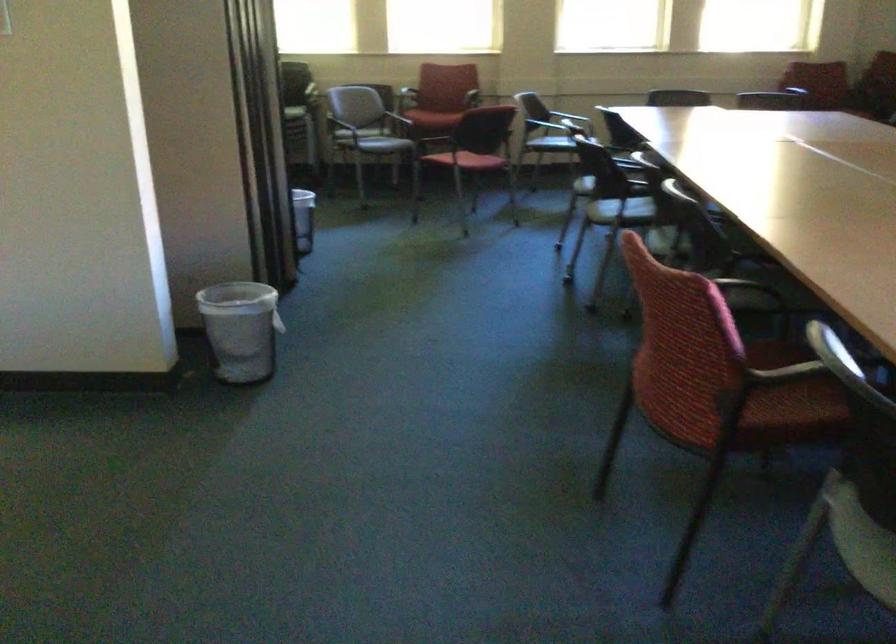
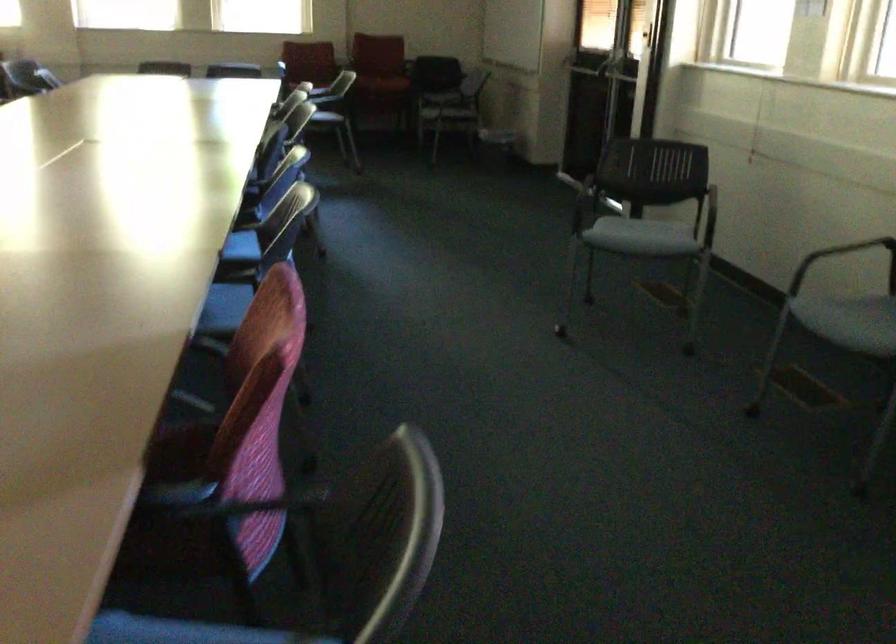
From the picture: What movement of the cameraman would produce the second image?

The cameraman walked toward right, backward.